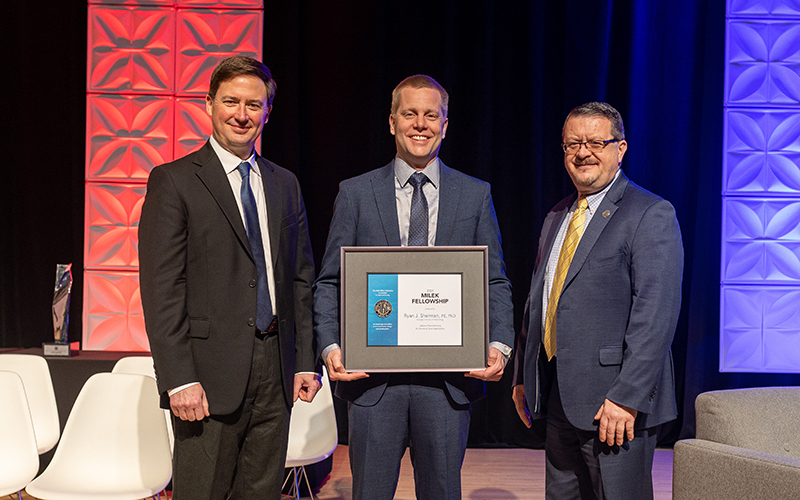
Find the location of a particular element. wood floor is located at coordinates (502, 473), (408, 490).